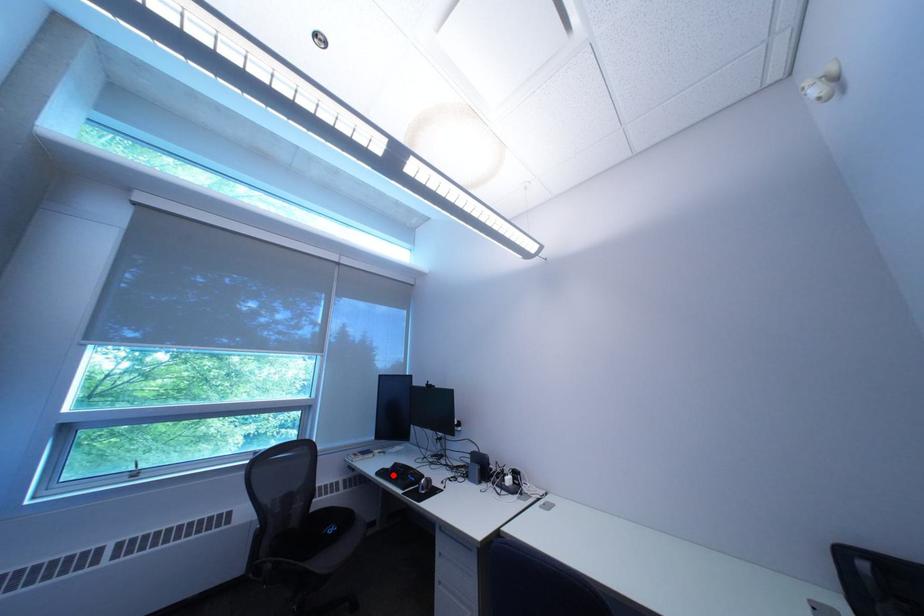
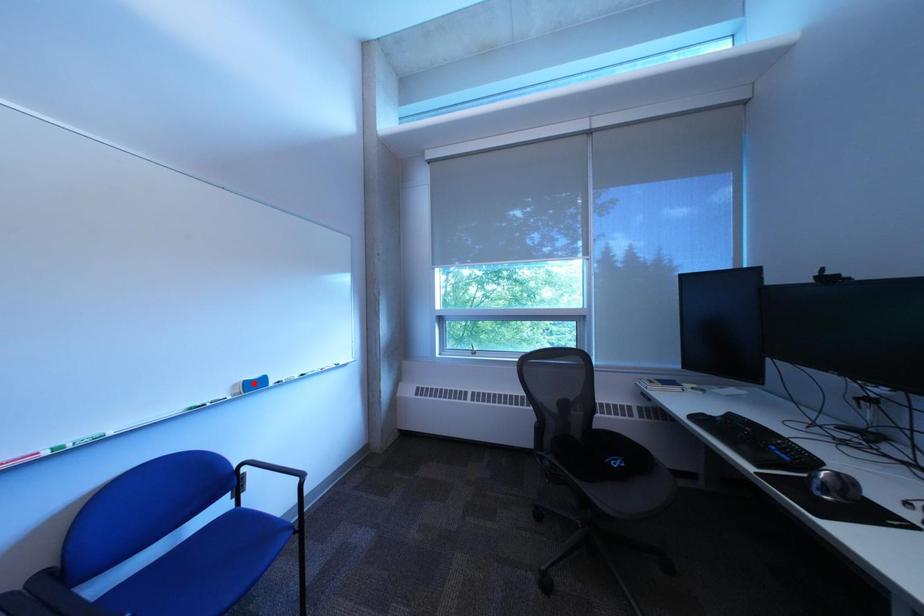
I am providing you with two images of the same scene from different viewpoints. A red point is marked on the first image and another point is marked on the second image. Do the highlighted points in image1 and image2 indicate the same real-world spot?

No